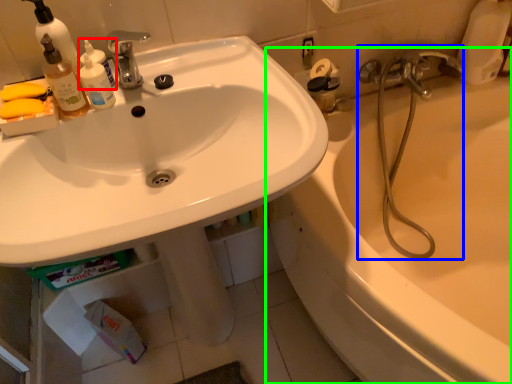
Question: Based on their relative distances, which object is farther from cleaning product (highlighted by a red box)? Choose from plumbing fixture (highlighted by a blue box) and bathtub (highlighted by a green box).

Choices:
 (A) plumbing fixture
 (B) bathtub

Answer: (B)